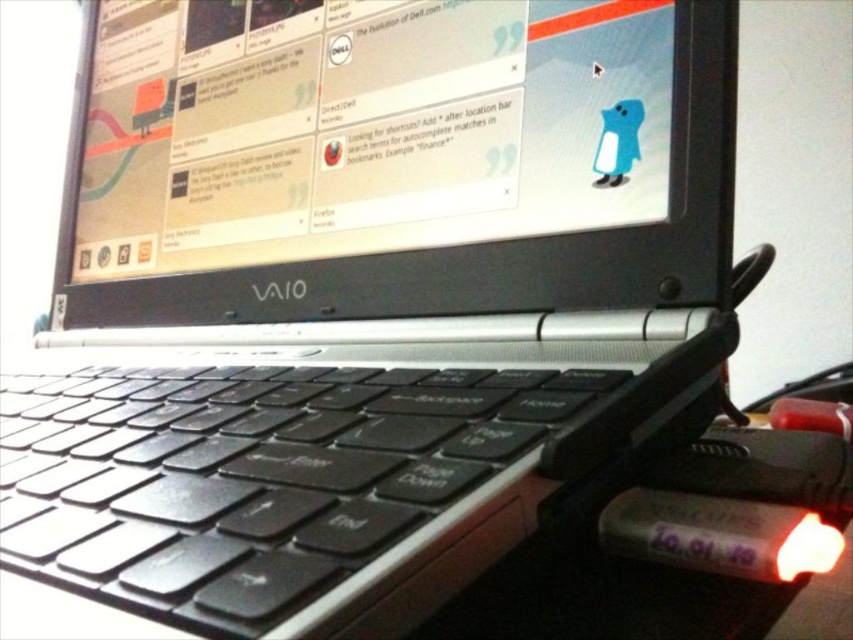
Question: In this image, where is matte black laptop at center located relative to black matte keyboard at center?

Choices:
 (A) right
 (B) left

Answer: (A)

Question: Which point is closer to the camera taking this photo?

Choices:
 (A) (80, 260)
 (B) (0, 484)

Answer: (B)

Question: Which of the following is the closest to the observer?

Choices:
 (A) (267, 403)
 (B) (625, 301)

Answer: (A)

Question: Can you confirm if matte black laptop at center is smaller than black matte keyboard at center?

Choices:
 (A) no
 (B) yes

Answer: (A)

Question: Which of the following is the farthest from the observer?

Choices:
 (A) (598, 225)
 (B) (294, 563)

Answer: (A)

Question: Is matte black laptop at center positioned at the back of black matte keyboard at center?

Choices:
 (A) no
 (B) yes

Answer: (B)